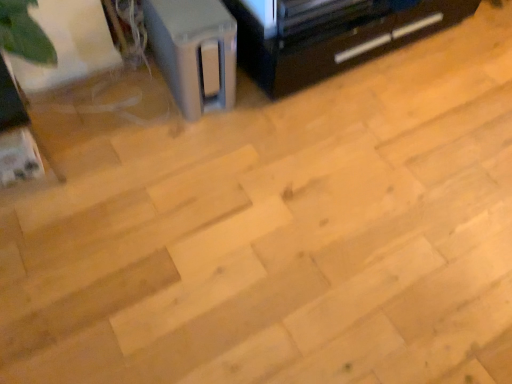
Image resolution: width=512 pixels, height=384 pixels. Describe the element at coordinates (329, 35) in the screenshot. I see `black plastic tv stand at upper right` at that location.

The height and width of the screenshot is (384, 512). I want to click on black plastic tv stand at upper right, so click(329, 35).

What is the approximate height of black plastic tv stand at upper right?

The height of black plastic tv stand at upper right is 10.58 inches.

Where is `satin gray speaker at upper left`? The height and width of the screenshot is (384, 512). satin gray speaker at upper left is located at coordinates (194, 52).

This screenshot has width=512, height=384. What do you see at coordinates (194, 52) in the screenshot? I see `satin gray speaker at upper left` at bounding box center [194, 52].

Image resolution: width=512 pixels, height=384 pixels. Identify the location of black plastic tv stand at upper right. (329, 35).

Considering the relative positions of satin gray speaker at upper left and black plastic tv stand at upper right in the image provided, is satin gray speaker at upper left to the left or to the right of black plastic tv stand at upper right?

In the image, satin gray speaker at upper left appears on the left side of black plastic tv stand at upper right.

In the image, is satin gray speaker at upper left positioned in front of or behind black plastic tv stand at upper right?

Clearly, satin gray speaker at upper left is in front of black plastic tv stand at upper right.

Considering the points (174, 47) and (323, 75), which point is behind, point (174, 47) or point (323, 75)?

The point (323, 75) is farther from the camera.

From the image's perspective, would you say satin gray speaker at upper left is positioned over black plastic tv stand at upper right?

No, from the image's perspective, satin gray speaker at upper left is not above black plastic tv stand at upper right.

From a real-world perspective, which is physically below, satin gray speaker at upper left or black plastic tv stand at upper right?

black plastic tv stand at upper right.

Considering the sizes of satin gray speaker at upper left and black plastic tv stand at upper right in the image, is satin gray speaker at upper left wider or thinner than black plastic tv stand at upper right?

Considering their sizes, satin gray speaker at upper left looks broader than black plastic tv stand at upper right.

Considering the sizes of satin gray speaker at upper left and black plastic tv stand at upper right in the image, is satin gray speaker at upper left taller or shorter than black plastic tv stand at upper right?

Considering their sizes, satin gray speaker at upper left has more height than black plastic tv stand at upper right.

Does satin gray speaker at upper left have a smaller size compared to black plastic tv stand at upper right?

Indeed, satin gray speaker at upper left has a smaller size compared to black plastic tv stand at upper right.

Is satin gray speaker at upper left not inside black plastic tv stand at upper right?

Yes, satin gray speaker at upper left is located beyond the bounds of black plastic tv stand at upper right.

Is satin gray speaker at upper left not near black plastic tv stand at upper right?

No, satin gray speaker at upper left is not far from black plastic tv stand at upper right.

Could you tell me if satin gray speaker at upper left is turned towards black plastic tv stand at upper right?

No, satin gray speaker at upper left is not facing towards black plastic tv stand at upper right.

How different are the orientations of satin gray speaker at upper left and black plastic tv stand at upper right in degrees?

The facing directions of satin gray speaker at upper left and black plastic tv stand at upper right are 5.43 degrees apart.

From the picture: Measure the distance from satin gray speaker at upper left to black plastic tv stand at upper right.

They are 13.35 inches apart.

You are a GUI agent. You are given a task and a screenshot of the screen. Output one action in this format:
    pyautogui.click(x=<x>, y=<y>)
    Task: Click on the furniture above the satin gray speaker at upper left (from the image's perspective)
    This screenshot has height=384, width=512.
    Given the screenshot: What is the action you would take?
    pyautogui.click(x=329, y=35)

Based on their positions, is black plastic tv stand at upper right located to the left or right of satin gray speaker at upper left?

Based on their positions, black plastic tv stand at upper right is located to the right of satin gray speaker at upper left.

Which is in front, black plastic tv stand at upper right or satin gray speaker at upper left?

satin gray speaker at upper left is more forward.

Which is farther from the camera, (228, 4) or (187, 37)?

The point (228, 4) is farther from the camera.

In the scene shown: From the image's perspective, between black plastic tv stand at upper right and satin gray speaker at upper left, who is located below?

satin gray speaker at upper left.

From a real-world perspective, who is located lower, black plastic tv stand at upper right or satin gray speaker at upper left?

black plastic tv stand at upper right is physically lower.

From the picture: In terms of width, does black plastic tv stand at upper right look wider or thinner when compared to satin gray speaker at upper left?

In the image, black plastic tv stand at upper right appears to be more narrow than satin gray speaker at upper left.

Can you confirm if black plastic tv stand at upper right is taller than satin gray speaker at upper left?

No.

Which of these two, black plastic tv stand at upper right or satin gray speaker at upper left, is smaller?

satin gray speaker at upper left.

Could satin gray speaker at upper left be considered to be inside black plastic tv stand at upper right?

Definitely not — satin gray speaker at upper left is not inside black plastic tv stand at upper right.

Does black plastic tv stand at upper right touch satin gray speaker at upper left?

No, black plastic tv stand at upper right is not touching satin gray speaker at upper left.

Could you tell me if black plastic tv stand at upper right is facing satin gray speaker at upper left?

No, black plastic tv stand at upper right is not facing towards satin gray speaker at upper left.

How many degrees apart are the facing directions of black plastic tv stand at upper right and satin gray speaker at upper left?

There is a 5.43-degree angle between the facing directions of black plastic tv stand at upper right and satin gray speaker at upper left.

This screenshot has height=384, width=512. I want to click on furniture behind the satin gray speaker at upper left, so click(329, 35).

This screenshot has width=512, height=384. I want to click on appliance located above the black plastic tv stand at upper right (from a real-world perspective), so click(x=194, y=52).

The image size is (512, 384). What are the coordinates of `appliance that appears below the black plastic tv stand at upper right (from the image's perspective)` in the screenshot? It's located at (194, 52).